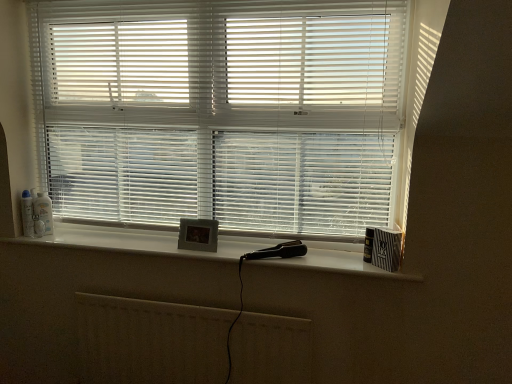
Question: Considering the positions of white matte window sill at center and white glossy spray can at left, acting as the 1th toiletry starting from the left, in the image, is white matte window sill at center taller or shorter than white glossy spray can at left, acting as the 1th toiletry starting from the left,?

Choices:
 (A) tall
 (B) short

Answer: (B)

Question: Considering their positions, is white matte window sill at center located in front of or behind white glossy spray can at left, which is the second toiletry in right-to-left order?

Choices:
 (A) front
 (B) behind

Answer: (A)

Question: Which is farther from the white glossy spray can at left, acting as the 1th toiletry starting from the left?

Choices:
 (A) white plastic bottle at left, which is the 2th toiletry from left to right
 (B) white plastic blinds at center
 (C) white matte radiator at lower center
 (D) white matte window sill at center

Answer: (B)

Question: Which is nearer to the white matte radiator at lower center?

Choices:
 (A) white plastic bottle at left, the 1th toiletry viewed from the right
 (B) white matte window sill at center
 (C) white plastic blinds at center
 (D) white glossy spray can at left, acting as the 1th toiletry starting from the left

Answer: (B)